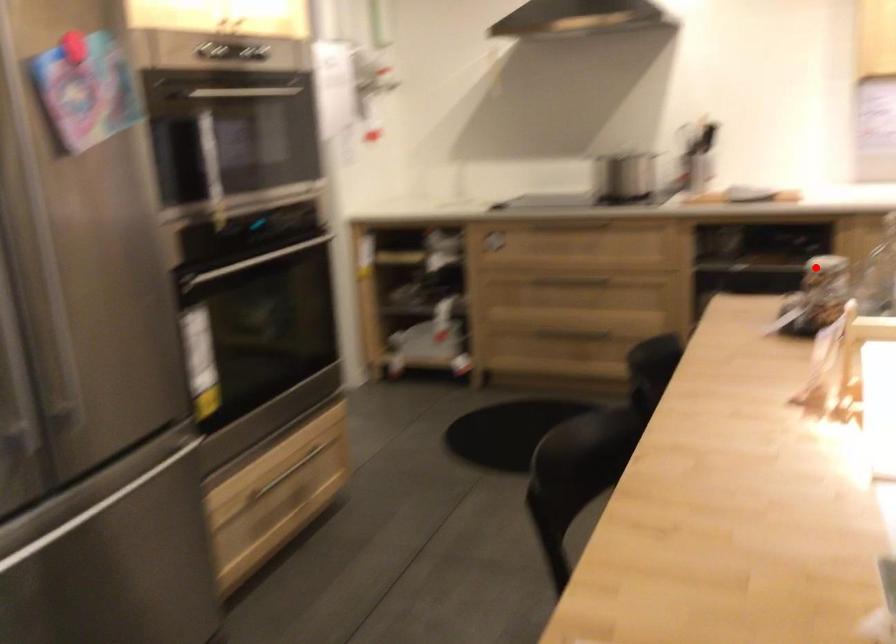
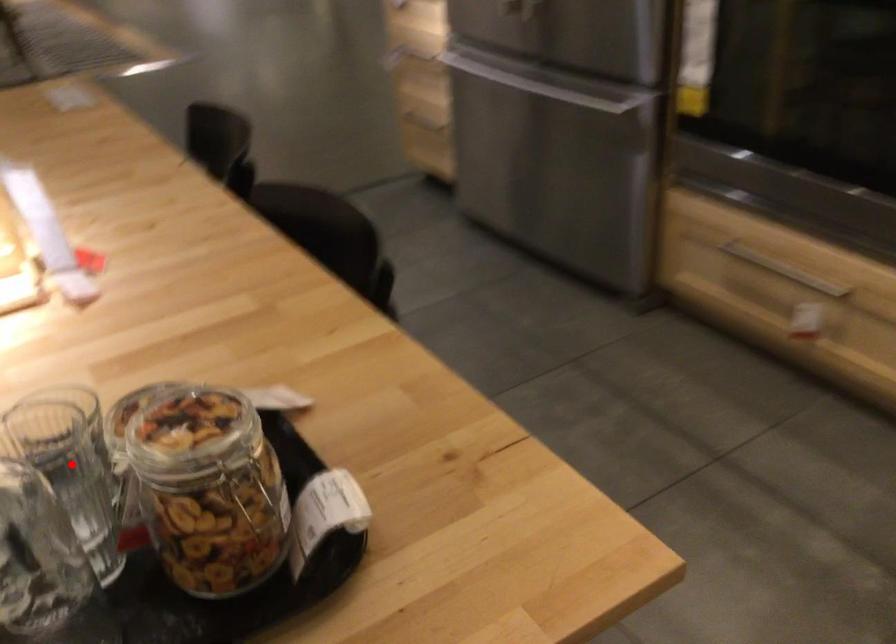
I am providing you with two images of the same scene from different viewpoints. A red point is marked on the first image and another point is marked on the second image. Is the red point in image1 aligned with the point shown in image2?

No